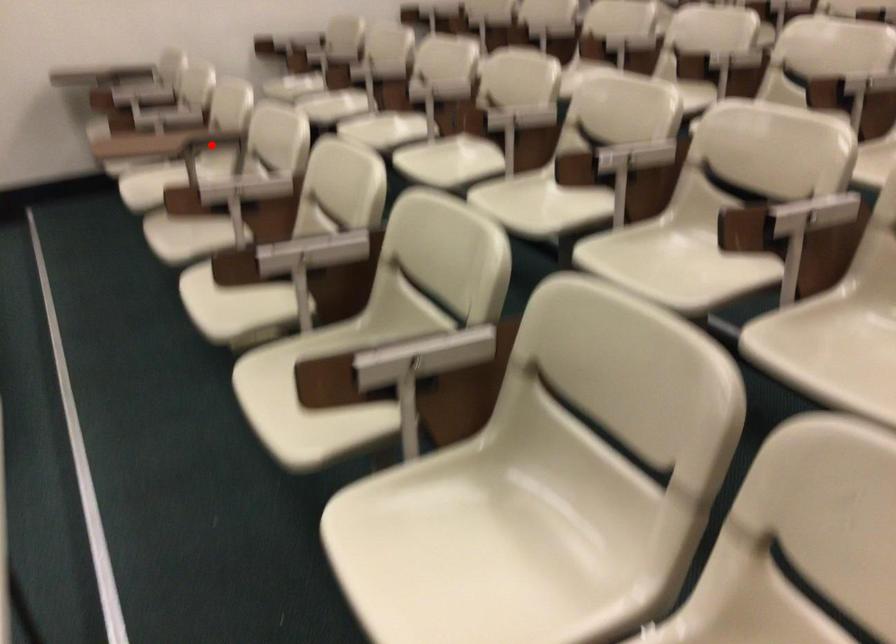
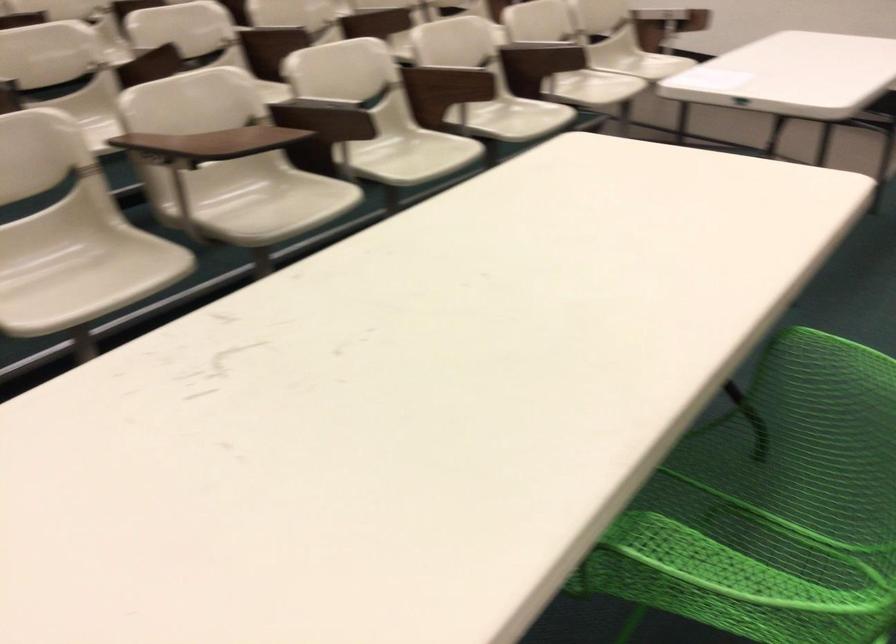
Question: I am providing you with two images of the same scene from different viewpoints. In image1, a red point is highlighted. Considering the same 3D point in image2, which of the following is correct?

Choices:
 (A) It is closer
 (B) It is farther

Answer: (A)